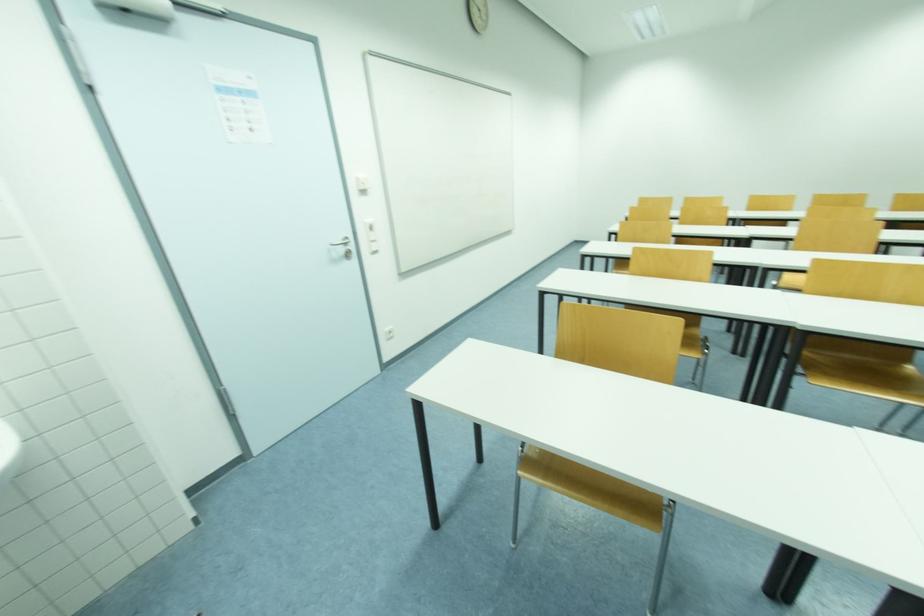
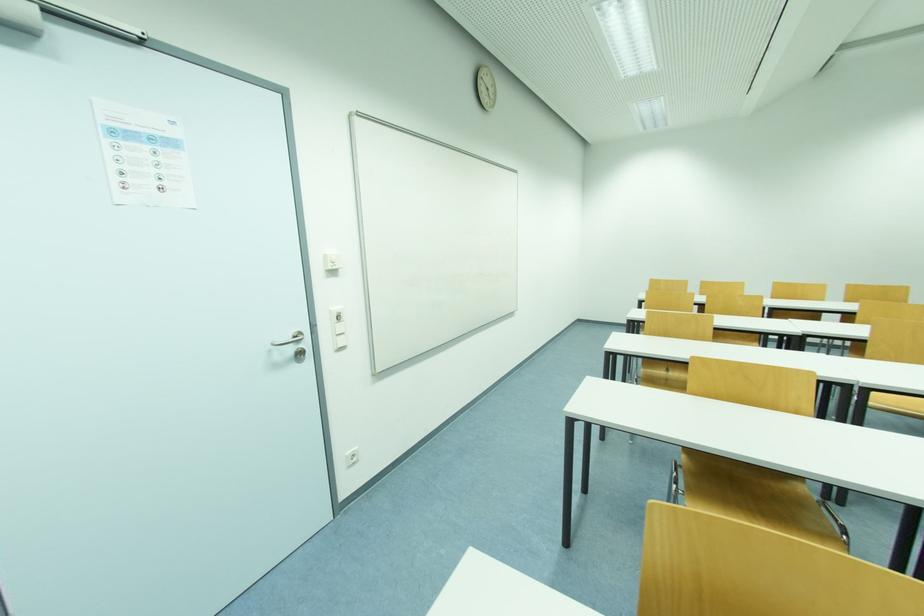
Question: The images are taken continuously from a first-person perspective. In which direction are you moving?

Choices:
 (A) Left
 (B) Right
 (C) Forward
 (D) Backward

Answer: (C)